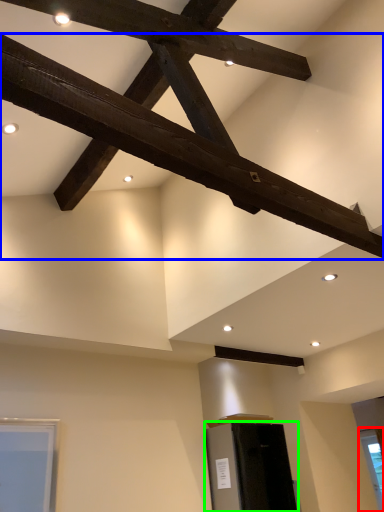
Question: Based on their relative distances, which object is nearer to window (highlighted by a red box)? Choose from beam (highlighted by a blue box) and furniture (highlighted by a green box).

Choices:
 (A) beam
 (B) furniture

Answer: (B)